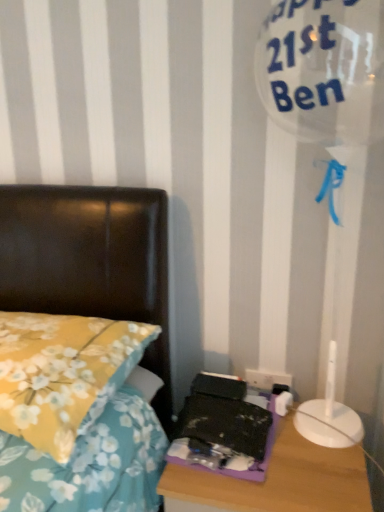
Question: Can you confirm if white plastic electric outlet at lower right is taller than purple plastic nightstand at lower right?

Choices:
 (A) yes
 (B) no

Answer: (B)

Question: Considering the relative positions of white plastic electric outlet at lower right and purple plastic nightstand at lower right in the image provided, is white plastic electric outlet at lower right behind purple plastic nightstand at lower right?

Choices:
 (A) no
 (B) yes

Answer: (B)

Question: Is white plastic electric outlet at lower right at the left side of purple plastic nightstand at lower right?

Choices:
 (A) yes
 (B) no

Answer: (B)

Question: Can you confirm if white plastic electric outlet at lower right is bigger than purple plastic nightstand at lower right?

Choices:
 (A) yes
 (B) no

Answer: (B)

Question: Is white plastic electric outlet at lower right positioned before purple plastic nightstand at lower right?

Choices:
 (A) no
 (B) yes

Answer: (A)

Question: From a real-world perspective, is white plastic electric outlet at lower right physically located above or below yellow floral fabric pillow at left?

Choices:
 (A) above
 (B) below

Answer: (B)

Question: Would you say white plastic electric outlet at lower right is inside or outside yellow floral fabric pillow at left?

Choices:
 (A) inside
 (B) outside

Answer: (B)

Question: In terms of size, does white plastic electric outlet at lower right appear bigger or smaller than yellow floral fabric pillow at left?

Choices:
 (A) big
 (B) small

Answer: (B)

Question: From their relative heights in the image, would you say white plastic electric outlet at lower right is taller or shorter than yellow floral fabric pillow at left?

Choices:
 (A) short
 (B) tall

Answer: (A)

Question: From a real-world perspective, relative to yellow floral fabric pillow at left, is purple plastic nightstand at lower right vertically above or below?

Choices:
 (A) below
 (B) above

Answer: (A)

Question: From the image's perspective, relative to yellow floral fabric pillow at left, is purple plastic nightstand at lower right above or below?

Choices:
 (A) above
 (B) below

Answer: (B)

Question: Considering the relative positions of purple plastic nightstand at lower right and yellow floral fabric pillow at left in the image provided, is purple plastic nightstand at lower right to the left or to the right of yellow floral fabric pillow at left?

Choices:
 (A) left
 (B) right

Answer: (B)

Question: Does point (292, 499) appear closer or farther from the camera than point (49, 353)?

Choices:
 (A) closer
 (B) farther

Answer: (A)

Question: Is purple plastic nightstand at lower right wider or thinner than white plastic electric outlet at lower right?

Choices:
 (A) thin
 (B) wide

Answer: (B)

Question: Considering the positions of purple plastic nightstand at lower right and white plastic electric outlet at lower right in the image, is purple plastic nightstand at lower right bigger or smaller than white plastic electric outlet at lower right?

Choices:
 (A) small
 (B) big

Answer: (B)